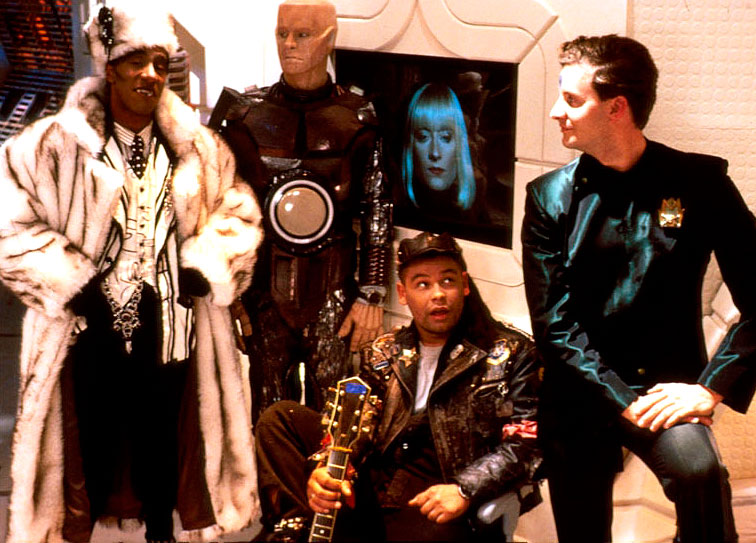
Locate an element on the screen. The image size is (756, 543). television is located at coordinates (413, 61).